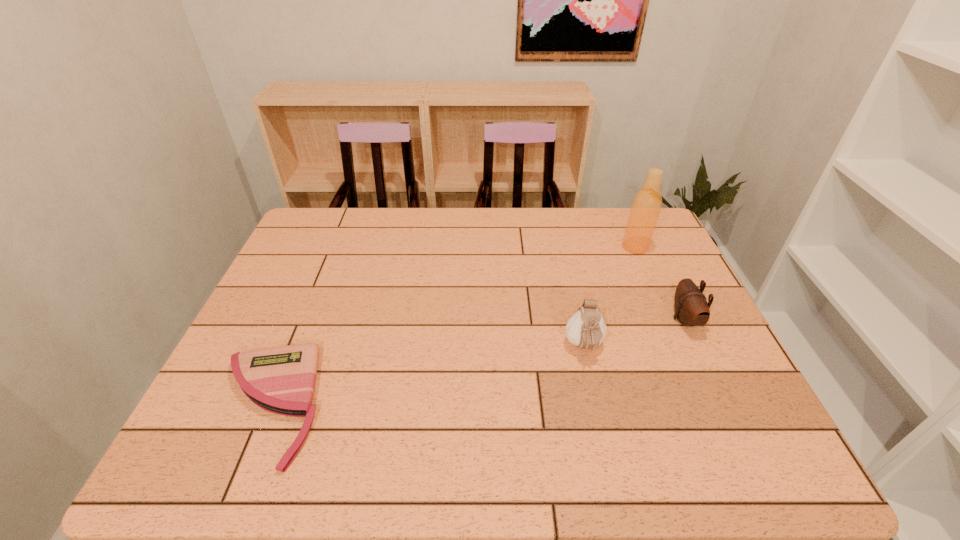
Image resolution: width=960 pixels, height=540 pixels. I want to click on the farthest object, so click(x=646, y=206).

Find the location of a particular element. This screenshot has width=960, height=540. beer bottle is located at coordinates (646, 206).

You are a GUI agent. You are given a task and a screenshot of the screen. Output one action in this format:
    pyautogui.click(x=<x>, y=<y>)
    Task: Click on the left pouch
    
    Given the screenshot: What is the action you would take?
    pyautogui.click(x=586, y=328)

At what (x,y) coordinates should I click in order to perform the action: click on the right pouch. Please return your answer as a coordinate pair (x, y). The image size is (960, 540). Looking at the image, I should click on (691, 308).

Where is `the shorter pouch`? the shorter pouch is located at coordinates (691, 308).

The height and width of the screenshot is (540, 960). What are the coordinates of `the shortest object` in the screenshot? It's located at (281, 380).

Where is `the leftmost object`? The height and width of the screenshot is (540, 960). the leftmost object is located at coordinates (281, 380).

You are a GUI agent. You are given a task and a screenshot of the screen. Output one action in this format:
    pyautogui.click(x=<x>, y=<y>)
    Task: Click on the vacant space located on the back of the tallest object
    
    Given the screenshot: What is the action you would take?
    pyautogui.click(x=620, y=212)

What are the coordinates of `blank space located on the front-facing side of the third object from right to left` in the screenshot? It's located at (610, 460).

Identify the location of vacant position located with the flap open on the shorter pouch. The width and height of the screenshot is (960, 540). (604, 319).